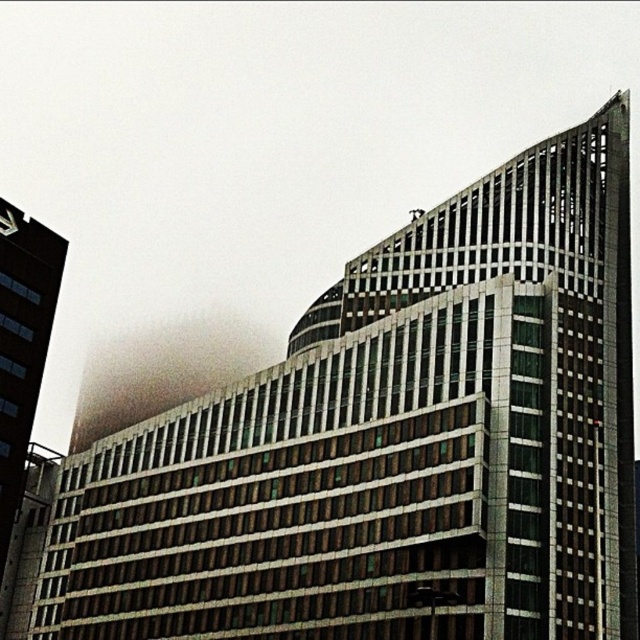
You are an architect analyzing the image of a modern building and a foggy cloud. Based on the scene, which object is taller between the foggy translucent cloud at upper center and the brown brick building at left?

The foggy translucent cloud at upper center has a greater height compared to the brown brick building at left, so the foggy translucent cloud at upper center is taller.

From the picture: You are standing in front of the modern architectural structure and notice the foggy translucent cloud at upper center and the brown brick building at left. Which object is closer to you?

The foggy translucent cloud at upper center is closer to you because it is further to the viewer than the brown brick building at left.